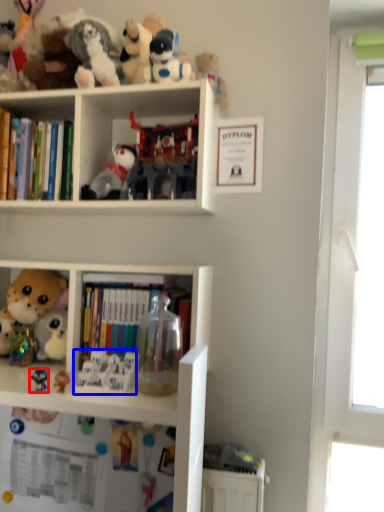
Question: Which object appears farthest to the camera in this image, toy (highlighted by a red box) or toy (highlighted by a blue box)?

Choices:
 (A) toy
 (B) toy

Answer: (A)